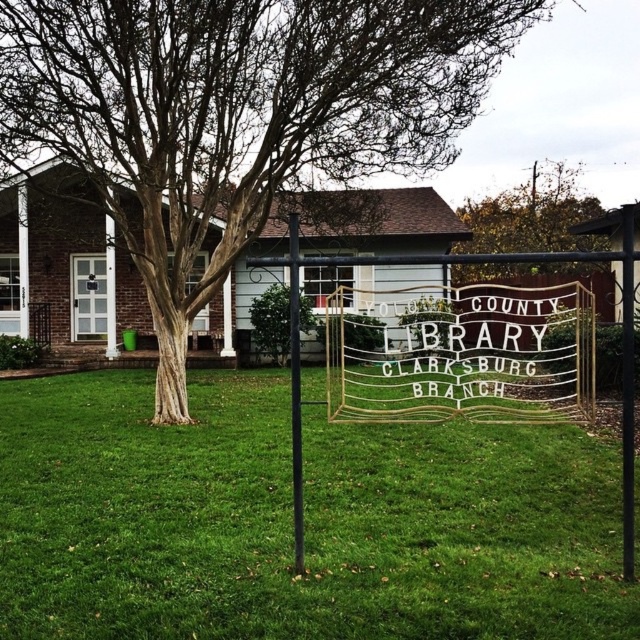
Question: Is green grass at center bigger than green leafy tree at center?

Choices:
 (A) no
 (B) yes

Answer: (B)

Question: Considering the relative positions of green grass at center and metallic pole at center in the image provided, where is green grass at center located with respect to metallic pole at center?

Choices:
 (A) above
 (B) below

Answer: (B)

Question: Considering the relative positions of green grass at center and brown bark tree at center in the image provided, where is green grass at center located with respect to brown bark tree at center?

Choices:
 (A) left
 (B) right

Answer: (B)

Question: Which point is closer to the camera taking this photo?

Choices:
 (A) 291,362
 (B) 156,316
 (C) 65,548

Answer: (C)

Question: Which object is closer to the camera taking this photo?

Choices:
 (A) green grass at center
 (B) brown bark tree at center
 (C) metallic pole at center
 (D) green leafy tree at center

Answer: (A)

Question: Which of these objects is positioned closest to the metallic pole at center?

Choices:
 (A) brown bark tree at center
 (B) green grass at center
 (C) green leafy tree at center

Answer: (B)